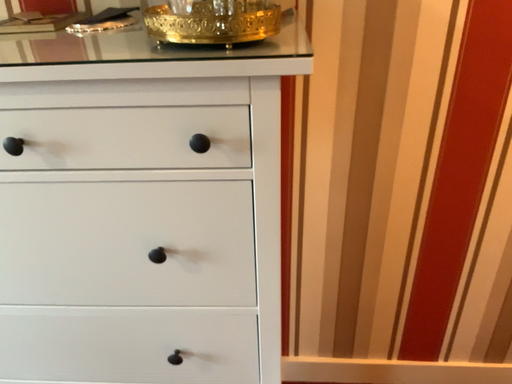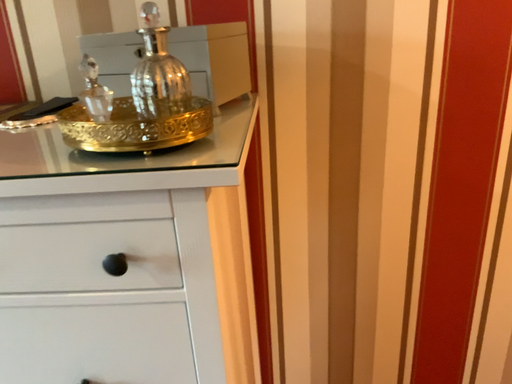
Question: Which way did the camera rotate in the video?

Choices:
 (A) rotated upward
 (B) rotated downward

Answer: (A)